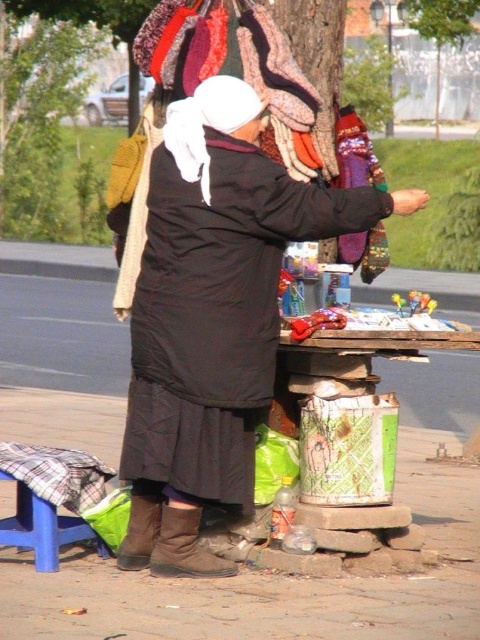
Question: Estimate the real-world distances between objects in this image. Which object is farther from the green leafy tree at left?

Choices:
 (A) black matte coat at center
 (B) green leafy tree at upper center

Answer: (A)

Question: Which object appears closest to the camera in this image?

Choices:
 (A) green leafy tree at upper center
 (B) green leafy tree at left
 (C) black matte coat at center

Answer: (C)

Question: Which of the following is the farthest from the observer?

Choices:
 (A) green leafy tree at upper center
 (B) green leafy tree at left

Answer: (B)

Question: Is green leafy tree at left behind green leafy tree at upper center?

Choices:
 (A) yes
 (B) no

Answer: (A)

Question: Is green leafy tree at left thinner than green leafy tree at upper center?

Choices:
 (A) yes
 (B) no

Answer: (B)

Question: Is green leafy tree at left smaller than green leafy tree at upper center?

Choices:
 (A) no
 (B) yes

Answer: (A)